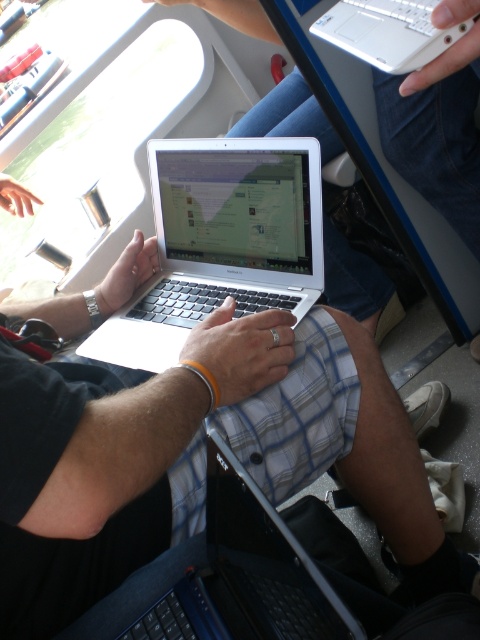
Which is behind, point (188, 620) or point (402, 0)?

The point (402, 0) is more distant.

Which is behind, point (337, 596) or point (381, 60)?

The point (381, 60) is more distant.

This screenshot has width=480, height=640. What are the coordinates of `black matte laptop at center` in the screenshot? It's located at (247, 573).

Looking at this image, which is above, silver metallic laptop at center or white plastic laptop at upper center?

white plastic laptop at upper center

Between silver metallic laptop at center and white plastic laptop at upper center, which one has more height?

With more height is silver metallic laptop at center.

What do you see at coordinates (220, 243) in the screenshot? I see `silver metallic laptop at center` at bounding box center [220, 243].

Locate an element on the screen. This screenshot has width=480, height=640. silver metallic laptop at center is located at coordinates (220, 243).

Does silver metallic laptop at center appear on the left side of black matte laptop at center?

Correct, you'll find silver metallic laptop at center to the left of black matte laptop at center.

Does silver metallic laptop at center appear on the right side of black matte laptop at center?

Incorrect, silver metallic laptop at center is not on the right side of black matte laptop at center.

Between point (172, 360) and point (343, 628), which one is positioned in front?

Point (343, 628)

The width and height of the screenshot is (480, 640). Find the location of `silver metallic laptop at center`. silver metallic laptop at center is located at coordinates (220, 243).